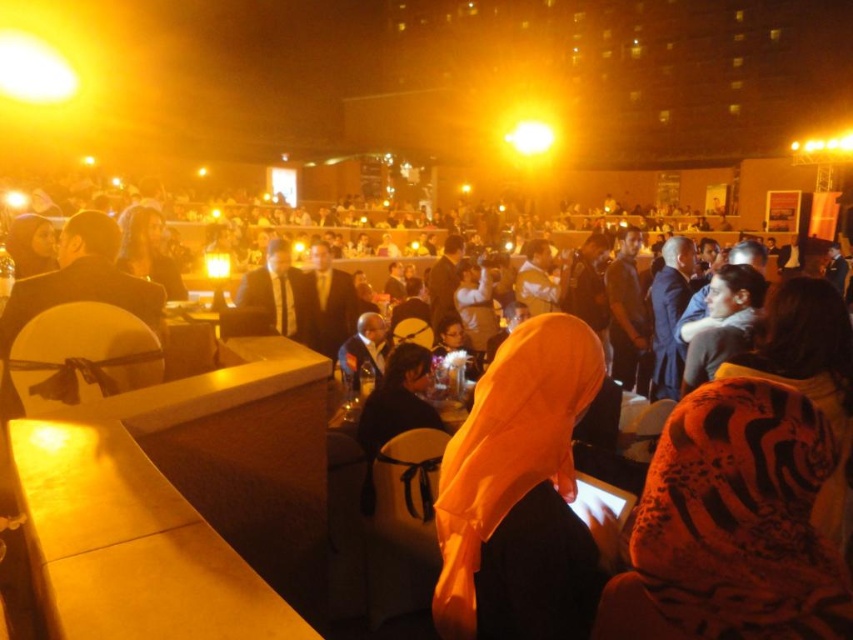
Question: Among these objects, which one is nearest to the camera?

Choices:
 (A) matte black suit at center
 (B) orange fabric headscarf at center
 (C) wooden table at lower left

Answer: (C)

Question: From the image, what is the correct spatial relationship of wooden table at lower left in relation to matte black suit at center?

Choices:
 (A) above
 (B) below

Answer: (B)

Question: Is orange fabric headscarf at center smaller than wooden table at lower left?

Choices:
 (A) no
 (B) yes

Answer: (B)

Question: Which of the following is the closest to the observer?

Choices:
 (A) (546, 563)
 (B) (303, 316)

Answer: (A)

Question: Which object appears closest to the camera in this image?

Choices:
 (A) orange fabric headscarf at center
 (B) wooden table at lower left

Answer: (B)

Question: Where is orange fabric headscarf at center located in relation to wooden table at lower left in the image?

Choices:
 (A) left
 (B) right

Answer: (B)